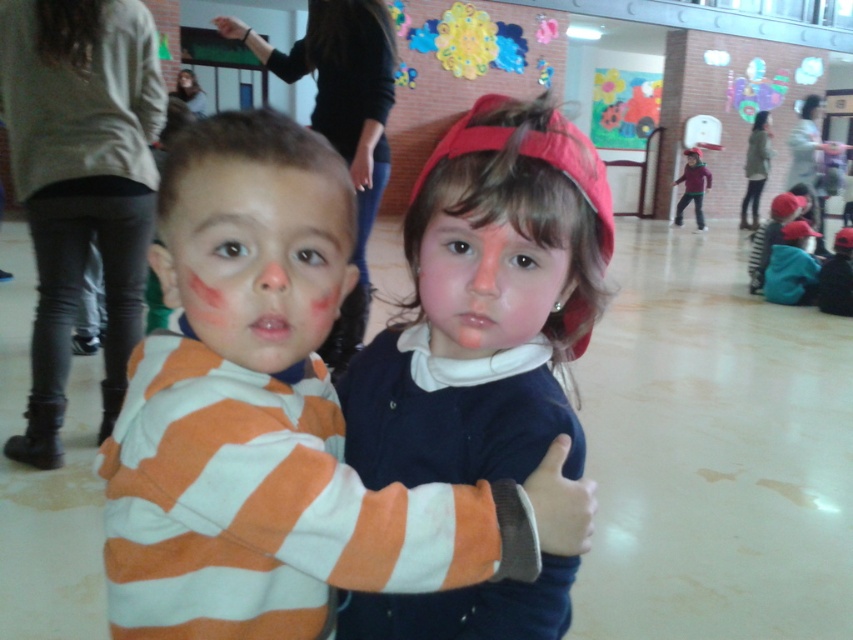
You are a photographer standing in front of the scene. You want to take a photo that includes both the matte blue sweater at center and the matte orange striped shirt at center. Which object should be placed lower in the photo to ensure both are visible?

The matte blue sweater at center is positioned under the matte orange striped shirt at center, so to ensure both are visible in the photo, the matte blue sweater at center should be placed lower.

You are a photographer trying to capture a group photo of the orange striped sweater at center and the smooth skin face at center. If you want to ensure both are fully visible in the frame, which object should you focus on to maintain the correct framing?

The orange striped sweater at center is wider than the smooth skin face at center, so focusing on the orange striped sweater at center will ensure both are fully visible in the frame.